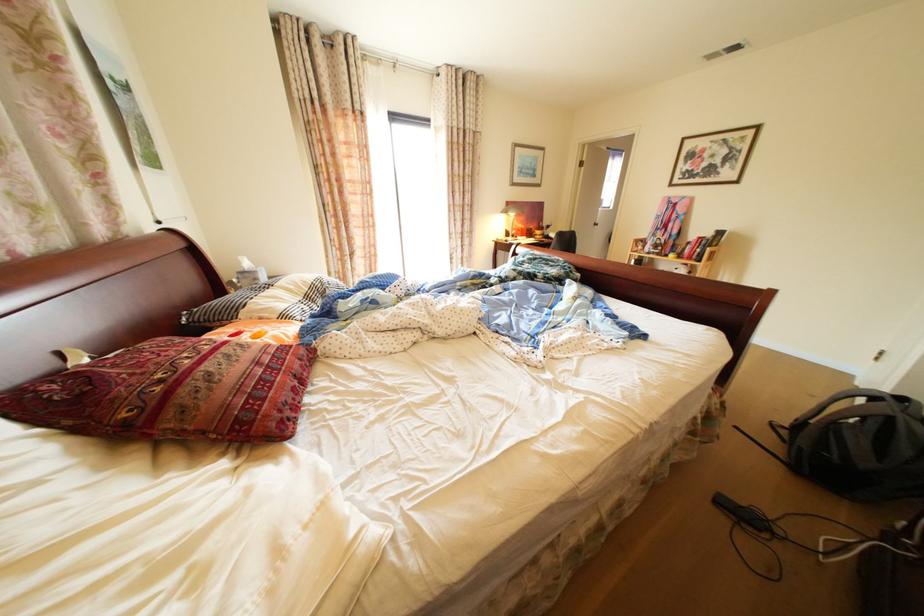
Image resolution: width=924 pixels, height=616 pixels. What do you see at coordinates (596, 223) in the screenshot?
I see `the white door knob` at bounding box center [596, 223].